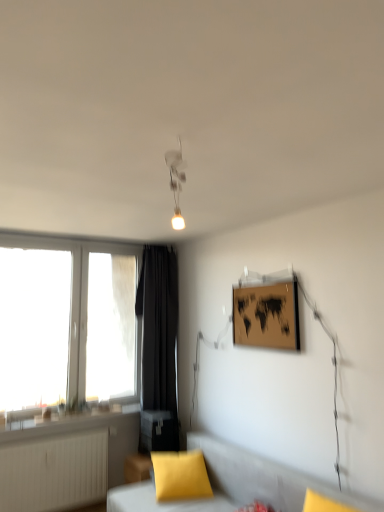
Question: Is matte yellow pillow at lower center thinner than white plastic window at left?

Choices:
 (A) no
 (B) yes

Answer: (A)

Question: Is white plastic window at left surrounded by matte yellow pillow at lower center?

Choices:
 (A) no
 (B) yes

Answer: (A)

Question: Is matte yellow pillow at lower center positioned before white plastic window at left?

Choices:
 (A) no
 (B) yes

Answer: (B)

Question: Considering the relative sizes of matte yellow pillow at lower center and white plastic window at left in the image provided, is matte yellow pillow at lower center shorter than white plastic window at left?

Choices:
 (A) no
 (B) yes

Answer: (B)

Question: From a real-world perspective, is matte yellow pillow at lower center on white plastic window at left?

Choices:
 (A) yes
 (B) no

Answer: (B)

Question: Is matte yellow pillow at lower center facing towards white plastic window at left?

Choices:
 (A) no
 (B) yes

Answer: (A)

Question: Is black fabric curtain at left aimed at matte yellow pillow at lower center?

Choices:
 (A) no
 (B) yes

Answer: (B)

Question: Is black fabric curtain at left turned away from matte yellow pillow at lower center?

Choices:
 (A) yes
 (B) no

Answer: (B)

Question: Is black fabric curtain at left surrounding matte yellow pillow at lower center?

Choices:
 (A) no
 (B) yes

Answer: (A)

Question: Is black fabric curtain at left further to camera compared to matte yellow pillow at lower center?

Choices:
 (A) yes
 (B) no

Answer: (A)

Question: Can you confirm if black fabric curtain at left is bigger than matte yellow pillow at lower center?

Choices:
 (A) no
 (B) yes

Answer: (B)

Question: Can you confirm if black fabric curtain at left is shorter than matte yellow pillow at lower center?

Choices:
 (A) no
 (B) yes

Answer: (A)

Question: Is soft gray cushion at lower center facing away from wooden matte picture frame at upper right?

Choices:
 (A) no
 (B) yes

Answer: (A)